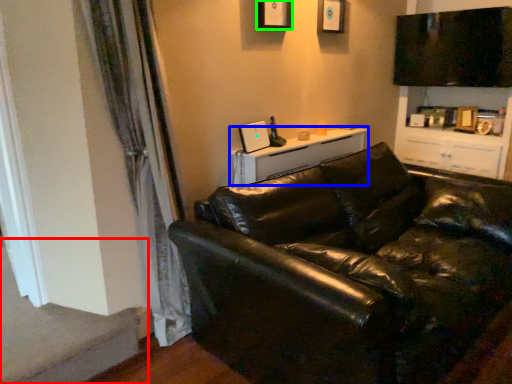
Question: Based on their relative distances, which object is nearer to stairwell (highlighted by a red box)? Choose from table (highlighted by a blue box) and picture frame (highlighted by a green box).

Choices:
 (A) table
 (B) picture frame

Answer: (A)